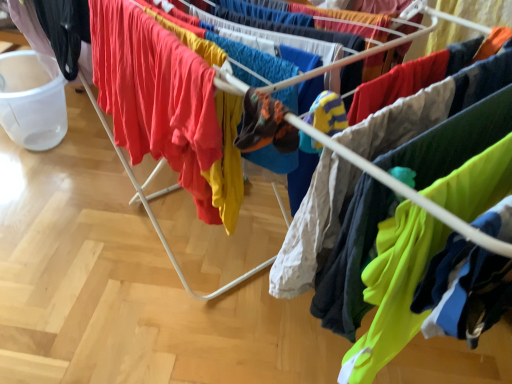
What do you see at coordinates (156, 96) in the screenshot? The image size is (512, 384). I see `matte red t-shirt at center, which ranks as the second clothing in right-to-left order` at bounding box center [156, 96].

What is the approximate width of black matte pants at left, placed as the third clothing when sorted from right to left?

It is 7.77 centimeters.

The height and width of the screenshot is (384, 512). I want to click on matte red t-shirt at center, which appears as the 2th clothing when viewed from the left, so click(x=156, y=96).

Can you confirm if neon green fabric at lower right, the 3th clothing in the left-to-right sequence, is shorter than matte red t-shirt at center, which ranks as the second clothing in right-to-left order?

Correct, neon green fabric at lower right, the 3th clothing in the left-to-right sequence, is not as tall as matte red t-shirt at center, which ranks as the second clothing in right-to-left order.

This screenshot has width=512, height=384. There is a neon green fabric at lower right, the 3th clothing in the left-to-right sequence. In order to click on the 1st clothing above it (from the image's perspective) in this screenshot , I will do `click(156, 96)`.

From the image's perspective, relative to matte red t-shirt at center, which appears as the 2th clothing when viewed from the left, is neon green fabric at lower right, the 3th clothing in the left-to-right sequence, above or below?

neon green fabric at lower right, the 3th clothing in the left-to-right sequence, is situated lower than matte red t-shirt at center, which appears as the 2th clothing when viewed from the left, in the image.

Considering the positions of objects neon green fabric at lower right, the 3th clothing in the left-to-right sequence, and matte red t-shirt at center, which ranks as the second clothing in right-to-left order, in the image provided, who is more to the left, neon green fabric at lower right, the 3th clothing in the left-to-right sequence, or matte red t-shirt at center, which ranks as the second clothing in right-to-left order,?

matte red t-shirt at center, which ranks as the second clothing in right-to-left order.

Are black matte pants at left, placed as the third clothing when sorted from right to left, and neon green fabric at lower right, which is the 1th clothing in right-to-left order, located far from each other?

Yes, black matte pants at left, placed as the third clothing when sorted from right to left, and neon green fabric at lower right, which is the 1th clothing in right-to-left order, are quite far apart.

You are a GUI agent. You are given a task and a screenshot of the screen. Output one action in this format:
    pyautogui.click(x=<x>, y=<y>)
    Task: Click on the 2nd clothing to the right of the black matte pants at left, placed as the third clothing when sorted from right to left, counting from the anchor's position
    This screenshot has width=512, height=384.
    Given the screenshot: What is the action you would take?
    pyautogui.click(x=463, y=291)

In the scene shown: Would you say black matte pants at left, placed as the third clothing when sorted from right to left, is to the left or to the right of neon green fabric at lower right, which is the 1th clothing in right-to-left order, in the picture?

black matte pants at left, placed as the third clothing when sorted from right to left, is to the left of neon green fabric at lower right, which is the 1th clothing in right-to-left order.

From a real-world perspective, between black matte pants at left, which is counted as the first clothing, starting from the left, and neon green fabric at lower right, which is the 1th clothing in right-to-left order, who is vertically higher?

neon green fabric at lower right, which is the 1th clothing in right-to-left order, is physically above.

From the image's perspective, would you say black matte pants at left, placed as the third clothing when sorted from right to left, is positioned over matte red t-shirt at center, which appears as the 2th clothing when viewed from the left?

Yes, from the image's perspective, black matte pants at left, placed as the third clothing when sorted from right to left, is above matte red t-shirt at center, which appears as the 2th clothing when viewed from the left.

I want to click on clothing above the matte red t-shirt at center, which appears as the 2th clothing when viewed from the left (from the image's perspective), so click(65, 30).

Can you confirm if black matte pants at left, which is counted as the first clothing, starting from the left, is positioned to the left of matte red t-shirt at center, which ranks as the second clothing in right-to-left order?

Yes, black matte pants at left, which is counted as the first clothing, starting from the left, is to the left of matte red t-shirt at center, which ranks as the second clothing in right-to-left order.

Can you confirm if matte red t-shirt at center, which appears as the 2th clothing when viewed from the left, is smaller than black matte pants at left, which is counted as the first clothing, starting from the left?

Actually, matte red t-shirt at center, which appears as the 2th clothing when viewed from the left, might be larger than black matte pants at left, which is counted as the first clothing, starting from the left.

Looking at this image, considering the positions of objects matte red t-shirt at center, which appears as the 2th clothing when viewed from the left, and black matte pants at left, placed as the third clothing when sorted from right to left, in the image provided, who is more to the right, matte red t-shirt at center, which appears as the 2th clothing when viewed from the left, or black matte pants at left, placed as the third clothing when sorted from right to left,?

Positioned to the right is matte red t-shirt at center, which appears as the 2th clothing when viewed from the left.

Is matte red t-shirt at center, which appears as the 2th clothing when viewed from the left, not near black matte pants at left, placed as the third clothing when sorted from right to left?

No.

Is matte red t-shirt at center, which appears as the 2th clothing when viewed from the left, wider than black matte pants at left, placed as the third clothing when sorted from right to left?

Yes.

Are neon green fabric at lower right, which is the 1th clothing in right-to-left order, and black matte pants at left, placed as the third clothing when sorted from right to left, far apart?

neon green fabric at lower right, which is the 1th clothing in right-to-left order, is far away from black matte pants at left, placed as the third clothing when sorted from right to left.

Visually, is neon green fabric at lower right, which is the 1th clothing in right-to-left order, positioned to the left or to the right of black matte pants at left, placed as the third clothing when sorted from right to left?

Clearly, neon green fabric at lower right, which is the 1th clothing in right-to-left order, is on the right of black matte pants at left, placed as the third clothing when sorted from right to left, in the image.

Is neon green fabric at lower right, which is the 1th clothing in right-to-left order, positioned with its back to black matte pants at left, which is counted as the first clothing, starting from the left?

Yes, neon green fabric at lower right, which is the 1th clothing in right-to-left order, is positioned with its back facing black matte pants at left, which is counted as the first clothing, starting from the left.

Can you confirm if neon green fabric at lower right, the 3th clothing in the left-to-right sequence, is wider than black matte pants at left, placed as the third clothing when sorted from right to left?

No.

Which is closer to the camera, [153,35] or [459,334]?

Point [459,334]

From a real-world perspective, is matte red t-shirt at center, which ranks as the second clothing in right-to-left order, positioned above or below neon green fabric at lower right, the 3th clothing in the left-to-right sequence?

From a real-world perspective, matte red t-shirt at center, which ranks as the second clothing in right-to-left order, is physically below neon green fabric at lower right, the 3th clothing in the left-to-right sequence.

In the scene shown: From the image's perspective, is matte red t-shirt at center, which appears as the 2th clothing when viewed from the left, over neon green fabric at lower right, the 3th clothing in the left-to-right sequence?

Indeed, from the image's perspective, matte red t-shirt at center, which appears as the 2th clothing when viewed from the left, is shown above neon green fabric at lower right, the 3th clothing in the left-to-right sequence.

Considering the relative sizes of matte red t-shirt at center, which ranks as the second clothing in right-to-left order, and neon green fabric at lower right, the 3th clothing in the left-to-right sequence, in the image provided, is matte red t-shirt at center, which ranks as the second clothing in right-to-left order, wider than neon green fabric at lower right, the 3th clothing in the left-to-right sequence,?

Yes, matte red t-shirt at center, which ranks as the second clothing in right-to-left order, is wider than neon green fabric at lower right, the 3th clothing in the left-to-right sequence.

Where is `clothing on the right of the matte red t-shirt at center, which appears as the 2th clothing when viewed from the left`? Image resolution: width=512 pixels, height=384 pixels. clothing on the right of the matte red t-shirt at center, which appears as the 2th clothing when viewed from the left is located at coordinates (463, 291).

Identify the location of clothing that is the 2nd object located in front of the black matte pants at left, placed as the third clothing when sorted from right to left. (463, 291).

Which object lies further to the anchor point matte red t-shirt at center, which ranks as the second clothing in right-to-left order, neon green fabric at lower right, which is the 1th clothing in right-to-left order, or black matte pants at left, placed as the third clothing when sorted from right to left?

neon green fabric at lower right, which is the 1th clothing in right-to-left order, lies further to matte red t-shirt at center, which ranks as the second clothing in right-to-left order, than the other object.

Estimate the real-world distances between objects in this image. Which object is further from matte red t-shirt at center, which appears as the 2th clothing when viewed from the left, black matte pants at left, which is counted as the first clothing, starting from the left, or neon green fabric at lower right, the 3th clothing in the left-to-right sequence?

Among the two, neon green fabric at lower right, the 3th clothing in the left-to-right sequence, is located further to matte red t-shirt at center, which appears as the 2th clothing when viewed from the left.

From the image, which object appears to be farther from neon green fabric at lower right, which is the 1th clothing in right-to-left order, matte red t-shirt at center, which appears as the 2th clothing when viewed from the left, or black matte pants at left, placed as the third clothing when sorted from right to left?

Among the two, black matte pants at left, placed as the third clothing when sorted from right to left, is located further to neon green fabric at lower right, which is the 1th clothing in right-to-left order.

Looking at the image, which one is located further to black matte pants at left, placed as the third clothing when sorted from right to left, matte red t-shirt at center, which ranks as the second clothing in right-to-left order, or neon green fabric at lower right, which is the 1th clothing in right-to-left order?

neon green fabric at lower right, which is the 1th clothing in right-to-left order, is positioned further to the anchor black matte pants at left, placed as the third clothing when sorted from right to left.

When comparing their distances from neon green fabric at lower right, which is the 1th clothing in right-to-left order, does black matte pants at left, which is counted as the first clothing, starting from the left, or matte red t-shirt at center, which appears as the 2th clothing when viewed from the left, seem closer?

matte red t-shirt at center, which appears as the 2th clothing when viewed from the left, lies closer to neon green fabric at lower right, which is the 1th clothing in right-to-left order, than the other object.

Looking at the image, which one is located closer to black matte pants at left, which is counted as the first clothing, starting from the left, neon green fabric at lower right, the 3th clothing in the left-to-right sequence, or matte red t-shirt at center, which ranks as the second clothing in right-to-left order?

matte red t-shirt at center, which ranks as the second clothing in right-to-left order, is closer to black matte pants at left, which is counted as the first clothing, starting from the left.

Locate an element on the screen. The width and height of the screenshot is (512, 384). clothing located between black matte pants at left, placed as the third clothing when sorted from right to left, and neon green fabric at lower right, which is the 1th clothing in right-to-left order, in the left-right direction is located at coordinates (156, 96).